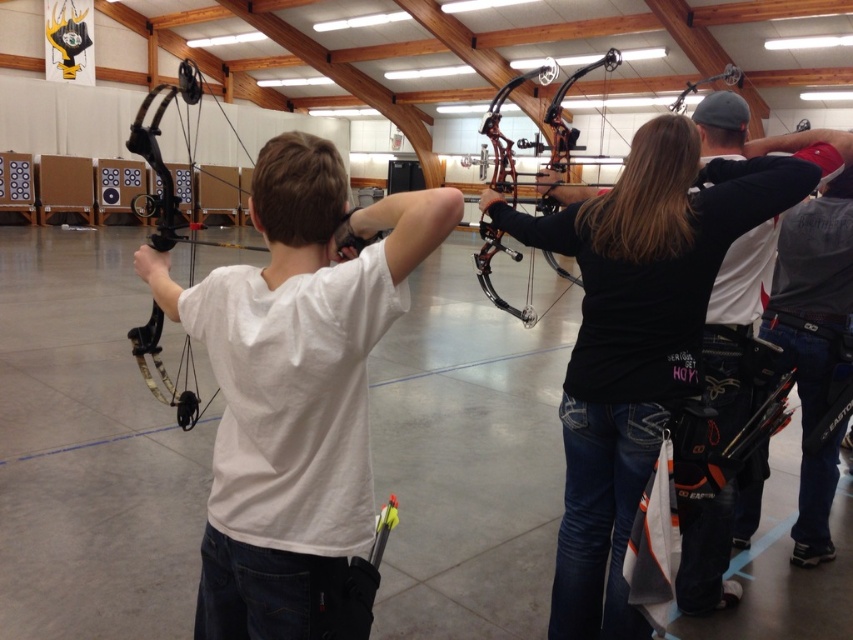
Question: Among these points, which one is farthest from the camera?

Choices:
 (A) (509, 212)
 (B) (235, 476)

Answer: (A)

Question: Is white matte shirt at center smaller than matte black bow at left?

Choices:
 (A) yes
 (B) no

Answer: (A)

Question: Which object is closer to the camera taking this photo?

Choices:
 (A) matte black bow at left
 (B) white matte shirt at center
 (C) black matte bow at center

Answer: (B)

Question: Is white matte shirt at center positioned in front of matte black bow at left?

Choices:
 (A) no
 (B) yes

Answer: (B)

Question: Does white matte shirt at center appear over matte black bow at left?

Choices:
 (A) yes
 (B) no

Answer: (B)

Question: Which object appears closest to the camera in this image?

Choices:
 (A) matte black bow at left
 (B) black matte bow at center
 (C) white matte shirt at center

Answer: (C)